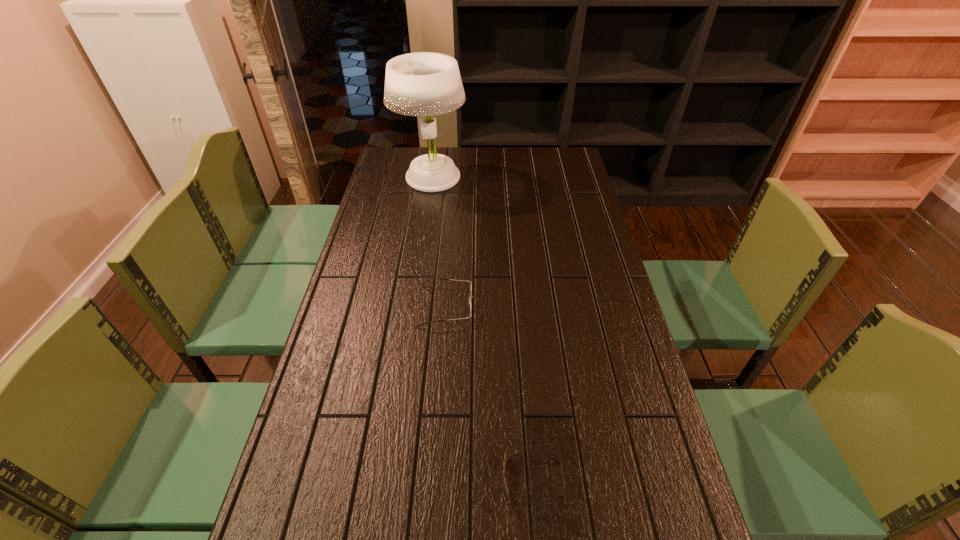
The height and width of the screenshot is (540, 960). I want to click on vacant space located on the front-facing side of the shortest object, so click(365, 480).

Where is `object that is positioned at the far edge`? The height and width of the screenshot is (540, 960). object that is positioned at the far edge is located at coordinates (420, 84).

I want to click on object that is at the left edge, so pyautogui.click(x=420, y=84).

Locate an element on the screen. The width and height of the screenshot is (960, 540). object situated at the far left corner is located at coordinates (420, 84).

This screenshot has height=540, width=960. What are the coordinates of `free space at the left edge` in the screenshot? It's located at (357, 240).

Find the location of `blank area at the right edge`. blank area at the right edge is located at coordinates (590, 339).

Identify the location of vacant space at the far right corner. 567,167.

Where is `free space between the shortest object and the second shortest object`? free space between the shortest object and the second shortest object is located at coordinates (489, 393).

This screenshot has height=540, width=960. Find the location of `free space between the sunglasses and the second farthest object`. free space between the sunglasses and the second farthest object is located at coordinates (489, 393).

This screenshot has width=960, height=540. I want to click on empty location between the spectacles and the tallest object, so click(x=439, y=242).